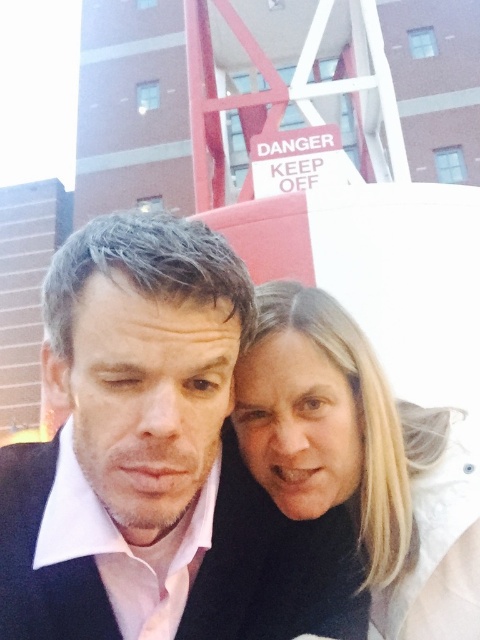
Question: In this image, where is blonde hair at center located relative to black matte business suit at center?

Choices:
 (A) above
 (B) below

Answer: (A)

Question: Which is nearer to the black matte business suit at center?

Choices:
 (A) blonde hair at center
 (B) pink matte shirt at center

Answer: (B)

Question: Is pink matte shirt at center further to camera compared to black matte business suit at center?

Choices:
 (A) no
 (B) yes

Answer: (A)

Question: Estimate the real-world distances between objects in this image. Which object is farther from the blonde hair at center?

Choices:
 (A) black matte business suit at center
 (B) pink matte shirt at center

Answer: (A)

Question: Does blonde hair at center lie in front of black matte business suit at center?

Choices:
 (A) no
 (B) yes

Answer: (A)

Question: Which is nearer to the blonde hair at center?

Choices:
 (A) pink matte shirt at center
 (B) black matte business suit at center

Answer: (A)